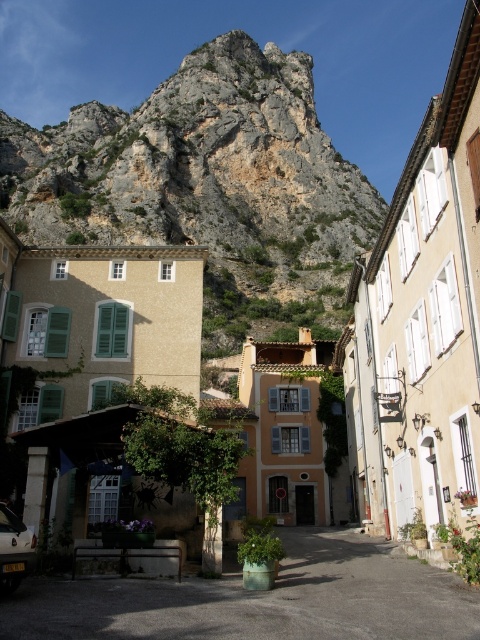
You are standing on the narrow street and want to take a photo of the rocky cliff at upper center and the green concrete planter at center. Which object should you position to the left side of your camera frame to include both in the shot?

You should position the rocky cliff at upper center to the left side of your camera frame since it is already located to the left of the green concrete planter at center.

You are standing at the entrance of the narrow street and want to take a photo of the rocky cliff at upper center. Based on its position, where should you aim your camera to capture it in the frame?

The rocky cliff at upper center is located at point (207, 188), so you should aim your camera towards the upper center area of the frame to capture it.

You are a tourist standing in the middle of the narrow street between the beige building with green shutters and the yellowish building with decorative shutters. You see two points marked on the ground ahead of you. The first point is at coordinates point [124,202] and the second is at point [148,616]. Which point is closer to you?

Point [124,202] is closer to you because it is further to the viewer than point [148,616], meaning it is nearer in the scene.